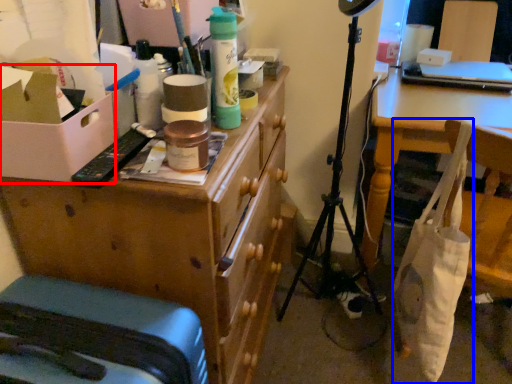
Question: Which object appears closest to the camera in this image, cardboard box (highlighted by a red box) or bag (highlighted by a blue box)?

Choices:
 (A) cardboard box
 (B) bag

Answer: (A)